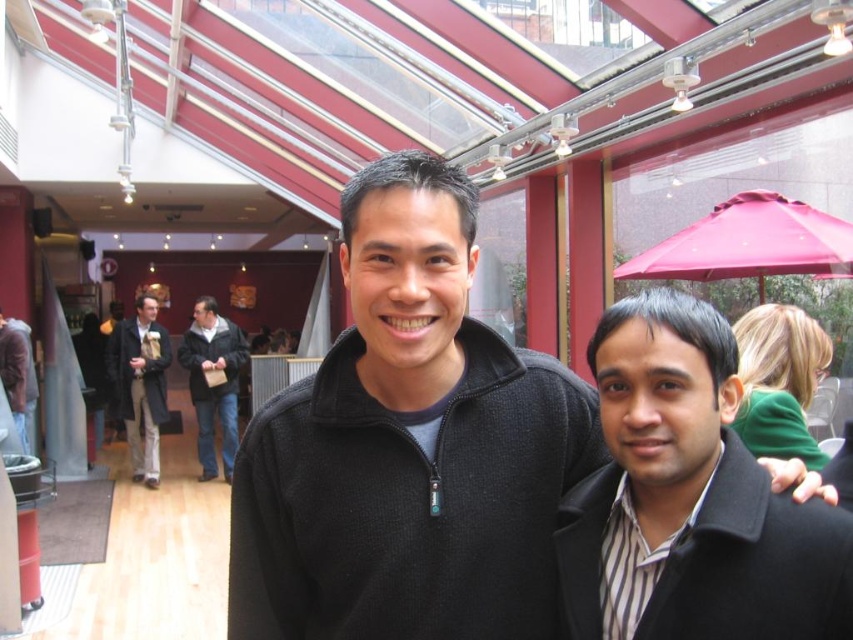
In the scene shown: Can you confirm if pink fabric canopy at upper right is thinner than dark brown leather coat at left?

No.

Is pink fabric canopy at upper right smaller than dark brown leather coat at left?

Yes.

Does point (705, 240) come closer to viewer compared to point (135, 451)?

That is True.

The height and width of the screenshot is (640, 853). In order to click on pink fabric canopy at upper right in this screenshot , I will do `click(747, 243)`.

Is point (769, 211) closer to camera compared to point (225, 438)?

Yes.

Can you confirm if pink fabric canopy at upper right is shorter than dark brown leather jacket at center?

Yes, pink fabric canopy at upper right is shorter than dark brown leather jacket at center.

Find the location of a particular element. This screenshot has height=640, width=853. pink fabric canopy at upper right is located at coordinates (747, 243).

At what (x,y) coordinates should I click in order to perform the action: click on pink fabric canopy at upper right. Please return your answer as a coordinate pair (x, y). Looking at the image, I should click on (747, 243).

Does point (679, 269) come in front of point (13, 346)?

Yes.

Is pink fabric canopy at upper right above matte black jacket at left?

Indeed, pink fabric canopy at upper right is positioned over matte black jacket at left.

Is point (813, 224) positioned behind point (26, 356)?

No, (813, 224) is closer to viewer.

Identify the location of pink fabric canopy at upper right. (747, 243).